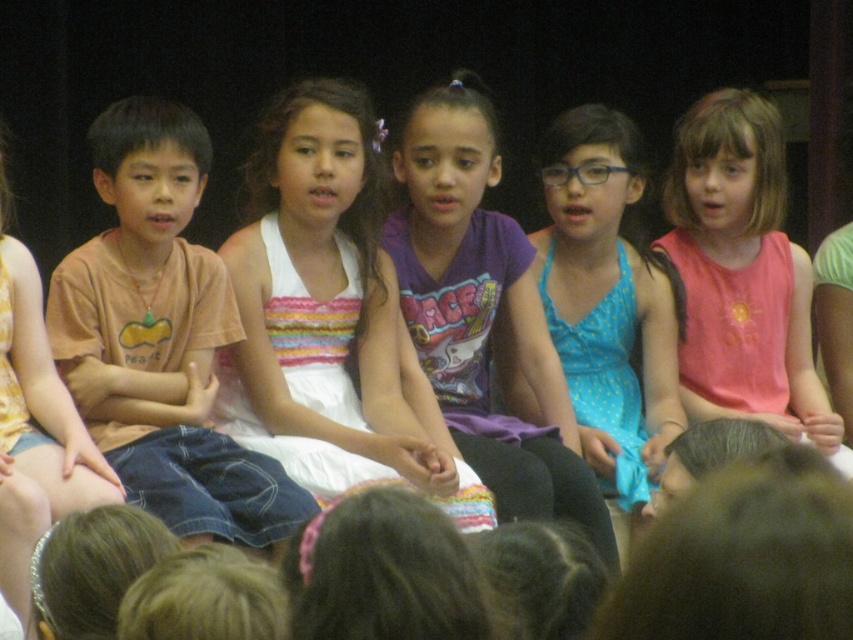
You are a photographer who needs to capture a closeup of the white satin dress at center. Based on the coordinates provided, where should you position your camera to ensure the dress is centered in the frame?

The white satin dress at center is located at coordinates point (326, 314), so positioning the camera directly facing that point will center the dress in the frame.

In the scene where children are performing, there is a white satin dress at center and a brown cotton shirt at left. From the perspective of someone watching the performance, which clothing item is positioned to the right of the other?

The white satin dress at center is positioned to the right of the brown cotton shirt at left.

You are a photographer trying to capture a clear shot of the white satin dress at center and the brown cotton shirt at left. Since the camera can only focus on one object at a time, which one should you choose to ensure the subject is fully visible in the frame?

The white satin dress at center is larger in size than the brown cotton shirt at left, so you should focus on the white satin dress at center to ensure it is fully visible in the frame.